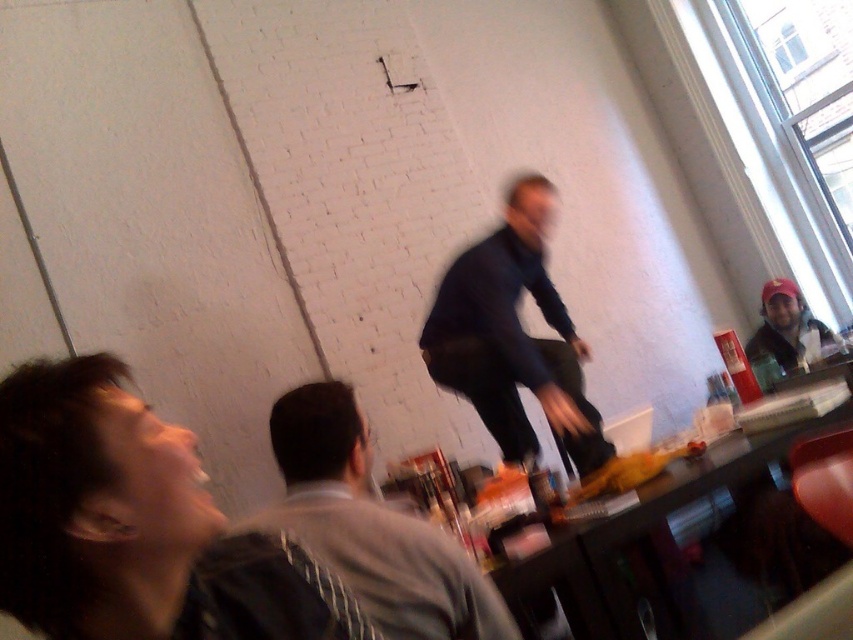
Question: Is dark brown hair at lower left further to camera compared to gray fabric shirt at center?

Choices:
 (A) yes
 (B) no

Answer: (B)

Question: Which of the following is the closest to the observer?

Choices:
 (A) (775, 320)
 (B) (30, 376)
 (C) (569, 566)

Answer: (B)

Question: Among these objects, which one is farthest from the camera?

Choices:
 (A) wooden table at center
 (B) dark brown hair at lower left

Answer: (A)

Question: Which object is positioned farthest from the matte black cap at upper right?

Choices:
 (A) gray fabric shirt at center
 (B) wooden table at center
 (C) dark brown hair at lower left

Answer: (C)

Question: Does gray fabric shirt at center appear under matte black cap at upper right?

Choices:
 (A) no
 (B) yes

Answer: (B)

Question: Is dark blue fabric pants at center further to camera compared to matte black cap at upper right?

Choices:
 (A) yes
 (B) no

Answer: (B)